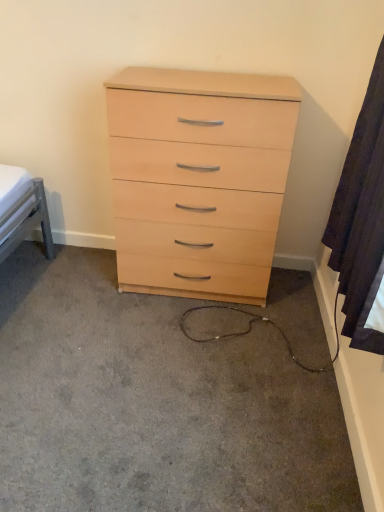
Image resolution: width=384 pixels, height=512 pixels. In order to click on free location above light wood/veneer chest of drawers at center (from a real-world perspective) in this screenshot , I will do `click(186, 74)`.